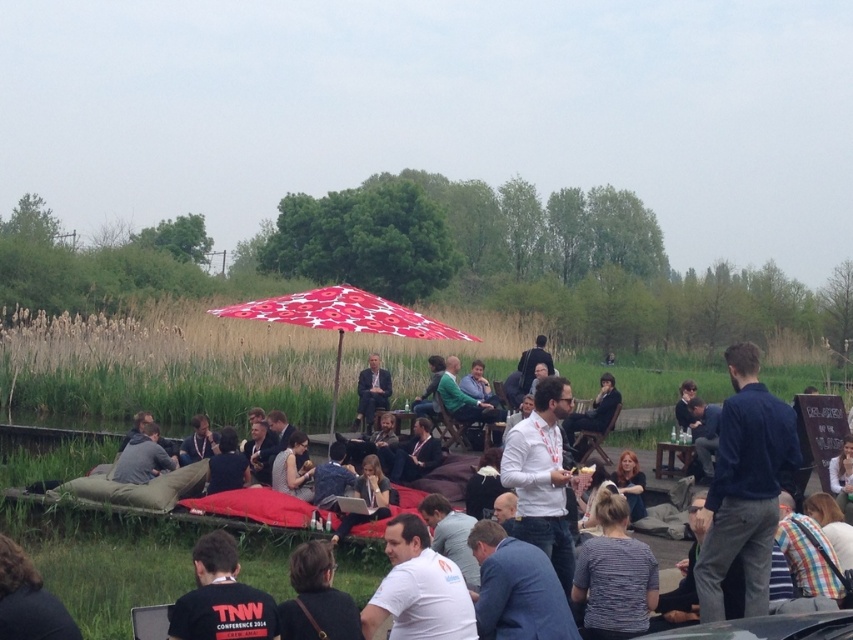
Question: Does dark blue shirt at center have a larger size compared to red printed fabric umbrella at center?

Choices:
 (A) yes
 (B) no

Answer: (B)

Question: Which is nearer to the matte black suit at center?

Choices:
 (A) red printed fabric umbrella at center
 (B) white cotton shirt at center
 (C) black t-shirt at lower left

Answer: (A)

Question: Among these objects, which one is nearest to the camera?

Choices:
 (A) dark blue shirt at center
 (B) matte black suit at center
 (C) white cotton shirt at center

Answer: (C)

Question: Is dark blue shirt at center bigger than red printed fabric umbrella at center?

Choices:
 (A) no
 (B) yes

Answer: (A)

Question: Can you confirm if white cotton shirt at center is wider than red printed fabric umbrella at center?

Choices:
 (A) no
 (B) yes

Answer: (A)

Question: Estimate the real-world distances between objects in this image. Which object is closer to the red printed fabric umbrella at center?

Choices:
 (A) dark blue shirt at center
 (B) white cotton shirt at center

Answer: (A)